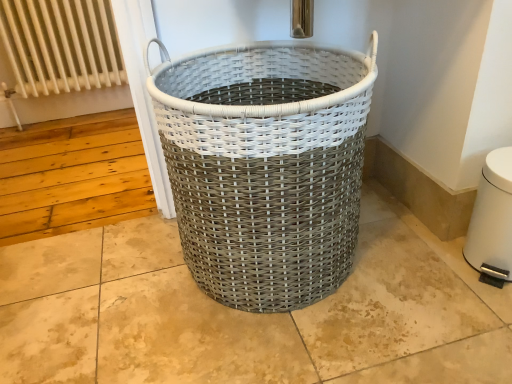
Where is `vacant space to the right of white woven basket at center`? The image size is (512, 384). vacant space to the right of white woven basket at center is located at coordinates (413, 267).